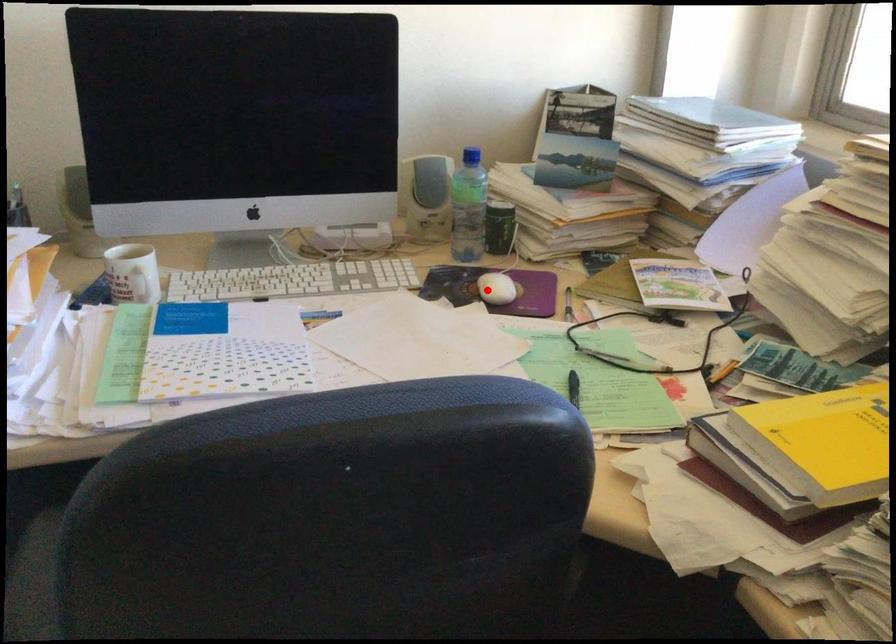
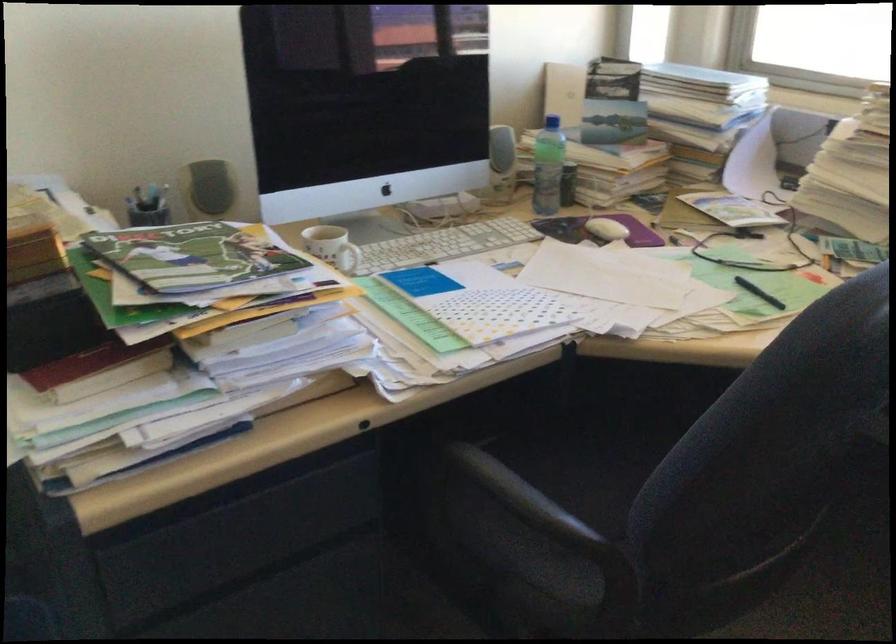
Where in the second image is the point corresponding to the highlighted location from the first image?

(606, 229)